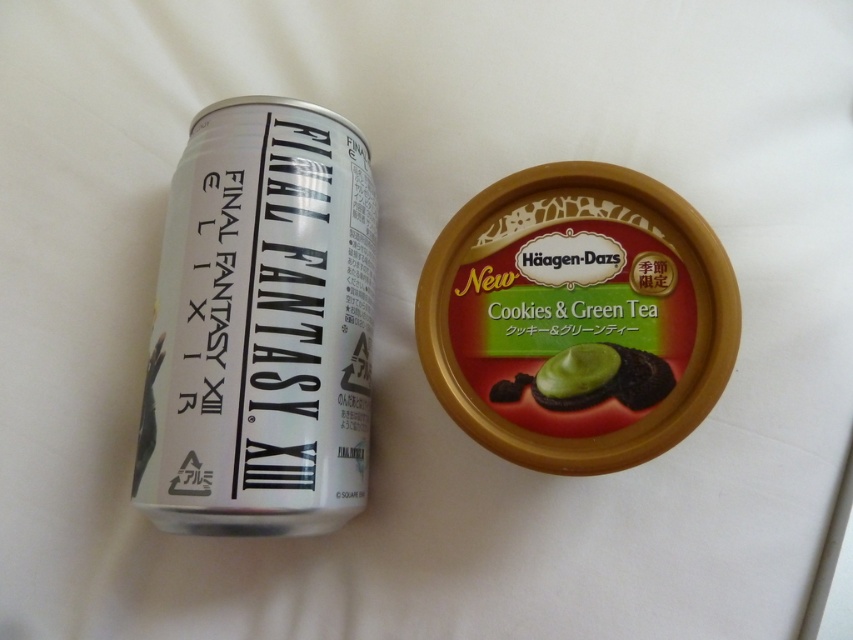
Describe the element at coordinates (577, 317) in the screenshot. I see `green matte ice cream container at center` at that location.

Is green matte ice cream container at center taller than green matte chocolate cookie at center?

Correct, green matte ice cream container at center is much taller as green matte chocolate cookie at center.

Is point (650, 376) farther from camera compared to point (607, 364)?

No, it is in front of (607, 364).

Where is `green matte ice cream container at center`? This screenshot has width=853, height=640. green matte ice cream container at center is located at coordinates (577, 317).